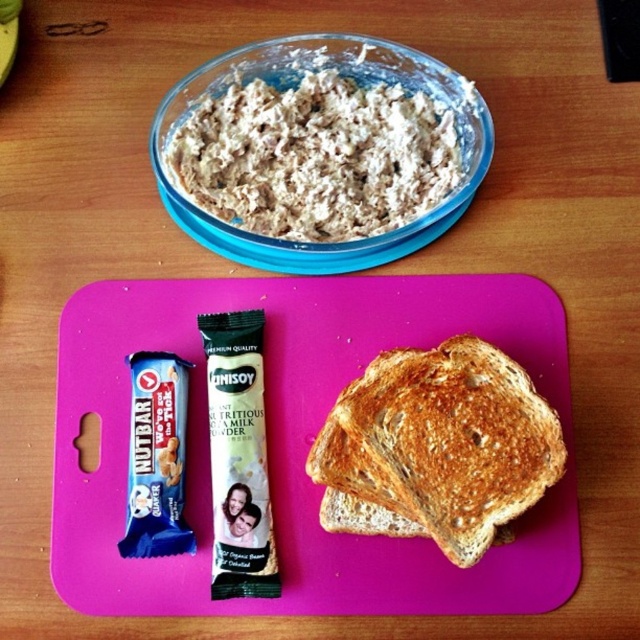
Looking at this image, you are a chef preparing a meal and see the translucent glass bowl at upper center and the yellow matte banana at upper left on the table. Which object is located above the other?

The yellow matte banana at upper left is above the translucent glass bowl at upper center because the bowl is positioned under the banana.

You are a food delivery person who needs to place a banana in a basket that can only hold items within 25 inches of each other. You see the golden brown toasted bread at center and the yellow matte banana at upper left. Can you safely place both items in the basket together?

The golden brown toasted bread at center and the yellow matte banana at upper left are 27.86 inches apart, which exceeds the basket limit of 25 inches. Therefore, they cannot be placed together in the basket.

Consider the image. You are a chef preparing a meal and need to place a 12 inch long spatula between the translucent glass bowl at upper center and the yellow matte banana at upper left. Can the spatula fit between them without touching either object?

The distance between the translucent glass bowl at upper center and the yellow matte banana at upper left is 17.38 inches. Since the spatula is 12 inches long, there is enough space for it to fit between them without touching either object.